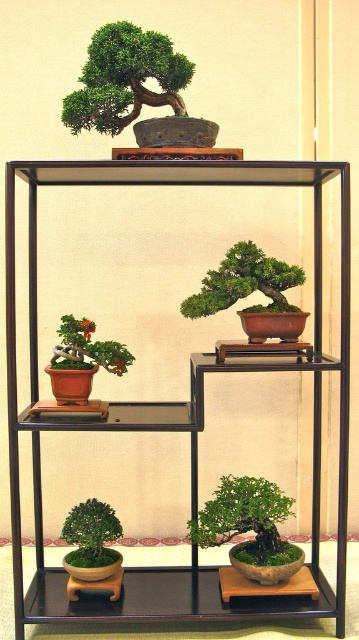
Question: Which point is closer to the camera?

Choices:
 (A) (110, 538)
 (B) (114, 355)
 (C) (94, 422)
 (D) (271, 285)

Answer: (C)

Question: Which point appears closest to the camera in this image?

Choices:
 (A) (78, 506)
 (B) (269, 544)
 (C) (106, 368)

Answer: (C)

Question: Is green matte bonsai tree at lower center smaller than matte brown bonsai at lower left?

Choices:
 (A) yes
 (B) no

Answer: (B)

Question: Where is green matte bonsai tree at lower left located in relation to matte brown bonsai at lower left in the image?

Choices:
 (A) above
 (B) below

Answer: (B)

Question: Is green matte bonsai tree at lower center wider than green matte bonsai tree at lower left?

Choices:
 (A) yes
 (B) no

Answer: (A)

Question: Which object appears farthest from the camera in this image?

Choices:
 (A) green matte bonsai tree at center
 (B) matte brown bonsai at lower left

Answer: (B)